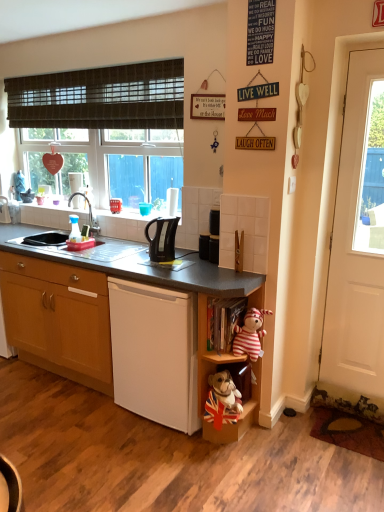
Find the location of `free space to the left of white matte dishwasher at center`. free space to the left of white matte dishwasher at center is located at coordinates (89, 416).